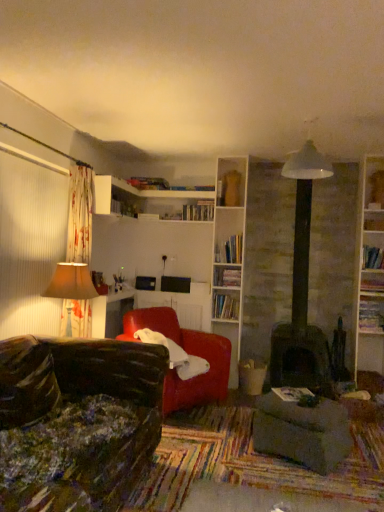
The image size is (384, 512). Describe the element at coordinates (371, 315) in the screenshot. I see `hardcover book at right, which ranks as the fourth book in right-to-left order` at that location.

In order to click on hardcover book at upper right, which is the 5th book from bottom to top in this screenshot , I will do `click(372, 258)`.

What do you see at coordinates (115, 197) in the screenshot? I see `white glossy bookshelf at upper center` at bounding box center [115, 197].

Measure the distance between point (199, 213) and camera.

A distance of 4.84 meters exists between point (199, 213) and camera.

Find the location of `hardcover book at right, placed as the ninth book when sorted from top to bottom`. hardcover book at right, placed as the ninth book when sorted from top to bottom is located at coordinates (371, 315).

Is hardcover book at center, the sixth book from the right, to the right of hardcover book at right, placed as the ninth book when sorted from top to bottom, from the viewer's perspective?

In fact, hardcover book at center, the sixth book from the right, is to the left of hardcover book at right, placed as the ninth book when sorted from top to bottom.

Which object is wider, hardcover book at center, the sixth book from the right, or hardcover book at right, placed as the ninth book when sorted from top to bottom?

hardcover book at center, the sixth book from the right.

Looking at this image, does hardcover book at center, the sixth book from the right, have a larger size compared to hardcover book at right, positioned as the 7th book in left-to-right order?

Correct, hardcover book at center, the sixth book from the right, is larger in size than hardcover book at right, positioned as the 7th book in left-to-right order.

How far apart are hardcover book at center, which is counted as the 5th book, starting from the left, and hardcover book at right, positioned as the 7th book in left-to-right order?

hardcover book at center, which is counted as the 5th book, starting from the left, is 1.47 meters away from hardcover book at right, positioned as the 7th book in left-to-right order.

Which is more to the right, dark gray fabric footrest at lower right or hardcover book at center, which is the 3th book from bottom to top?

dark gray fabric footrest at lower right is more to the right.

Does dark gray fabric footrest at lower right have a larger size compared to hardcover book at center, which is the 3th book from bottom to top?

Correct, dark gray fabric footrest at lower right is larger in size than hardcover book at center, which is the 3th book from bottom to top.

Can you confirm if dark gray fabric footrest at lower right is taller than hardcover book at center, which ranks as the 4th book in left-to-right order?

Yes.

Is hardcover book at center, which is the 3th book from bottom to top, a part of dark gray fabric footrest at lower right?

Definitely not — hardcover book at center, which is the 3th book from bottom to top, is not inside dark gray fabric footrest at lower right.

Between hardcover book at upper right, which is counted as the 2th book, starting from the right, and hardcover book at center, which is counted as the 5th book, starting from the left, which one has larger size?

hardcover book at center, which is counted as the 5th book, starting from the left.

Considering the relative sizes of hardcover book at upper right, which is the 5th book from bottom to top, and hardcover book at center, which is counted as the 5th book, starting from the left, in the image provided, is hardcover book at upper right, which is the 5th book from bottom to top, taller than hardcover book at center, which is counted as the 5th book, starting from the left,?

No, hardcover book at upper right, which is the 5th book from bottom to top, is not taller than hardcover book at center, which is counted as the 5th book, starting from the left.

What's the angular difference between hardcover book at upper right, which is counted as the 2th book, starting from the right, and hardcover book at center, the sixth book from the right,'s facing directions?

The angular difference between hardcover book at upper right, which is counted as the 2th book, starting from the right, and hardcover book at center, the sixth book from the right, is 0.187 degrees.

From the image's perspective, who appears lower, hardcover book at upper right, placed as the 9th book when sorted from left to right, or hardcover book at center, which is the fifth book from top to bottom?

hardcover book at upper right, placed as the 9th book when sorted from left to right, is shown below in the image.

From a real-world perspective, relative to hardcover book at upper right, which is counted as the 6th book, starting from the top, is hardcover book at right, positioned as the 7th book in left-to-right order, vertically above or below?

hardcover book at right, positioned as the 7th book in left-to-right order, is situated lower than hardcover book at upper right, which is counted as the 6th book, starting from the top, in the real world.

Could you tell me if hardcover book at right, which ranks as the fourth book in right-to-left order, is turned towards hardcover book at upper right, placed as the 9th book when sorted from left to right?

No, hardcover book at right, which ranks as the fourth book in right-to-left order, is not facing towards hardcover book at upper right, placed as the 9th book when sorted from left to right.

From the image's perspective, is hardcover book at right, positioned as the 7th book in left-to-right order, located above hardcover book at upper right, which is counted as the 6th book, starting from the top?

No, from the image's perspective, hardcover book at right, positioned as the 7th book in left-to-right order, is not above hardcover book at upper right, which is counted as the 6th book, starting from the top.

Can you confirm if hardcover book at center, which ranks as the 10th book in top-to-bottom order, is shorter than hardcover book at center, which is the 3th book from bottom to top?

Yes, hardcover book at center, which ranks as the 10th book in top-to-bottom order, is shorter than hardcover book at center, which is the 3th book from bottom to top.

Is hardcover book at center, which ranks as the 4th book in left-to-right order, a part of hardcover book at center, the fifth book from the right?

That's incorrect, hardcover book at center, which ranks as the 4th book in left-to-right order, is not inside hardcover book at center, the fifth book from the right.

From a real-world perspective, is hardcover book at center, which ranks as the 6th book in left-to-right order, positioned above or below hardcover book at center, which ranks as the 4th book in left-to-right order?

Clearly, from a real-world perspective, hardcover book at center, which ranks as the 6th book in left-to-right order, is below hardcover book at center, which ranks as the 4th book in left-to-right order.

Based on the photo, can you tell me how much hardcover book at center, the fifth book from the right, and hardcover book at center, the 8th book positioned from the top, differ in facing direction?

There is a 23.7-degree angle between the facing directions of hardcover book at center, the fifth book from the right, and hardcover book at center, the 8th book positioned from the top.

Can you confirm if hardcover book at upper right, marked as the tenth book in a left-to-right arrangement, is positioned to the right of matte red armchair at center?

Yes.

Measure the distance between hardcover book at upper right, marked as the seventh book in a bottom-to-top arrangement, and matte red armchair at center.

They are 2.30 meters apart.

From the image's perspective, between hardcover book at upper right, marked as the seventh book in a bottom-to-top arrangement, and matte red armchair at center, which one is located above?

hardcover book at upper right, marked as the seventh book in a bottom-to-top arrangement, is shown above in the image.

Does hardcover book at upper right, marked as the seventh book in a bottom-to-top arrangement, have a greater height compared to matte red armchair at center?

No.

Is white glossy bookshelf at upper center far from hardcover book at upper right, marked as the tenth book in a left-to-right arrangement?

Yes.

Considering the sizes of white glossy bookshelf at upper center and hardcover book at upper right, positioned as the first book in right-to-left order, in the image, is white glossy bookshelf at upper center taller or shorter than hardcover book at upper right, positioned as the first book in right-to-left order,?

In the image, white glossy bookshelf at upper center appears to be taller than hardcover book at upper right, positioned as the first book in right-to-left order.

Is white glossy bookshelf at upper center situated inside hardcover book at upper right, positioned as the fourth book in top-to-bottom order, or outside?

white glossy bookshelf at upper center is outside hardcover book at upper right, positioned as the fourth book in top-to-bottom order.

What are the coordinates of `the 3rd book below the white glossy bookshelf at upper center (from the image's perspective)` in the screenshot? It's located at (374, 223).

What are the coordinates of `book that is the 2nd object to the left of the hardcover book at right, placed as the ninth book when sorted from top to bottom, starting at the anchor` in the screenshot? It's located at (230, 250).

Locate an element on the screen. The width and height of the screenshot is (384, 512). book that is the 3rd object located above the dark gray fabric footrest at lower right (from the image's perspective) is located at coordinates (225, 306).

When comparing their distances from hardcover book at center, which ranks as the 10th book in top-to-bottom order, does dark gray fabric footrest at lower right or hardcover book at upper right, which is counted as the 2th book, starting from the right, seem closer?

dark gray fabric footrest at lower right lies closer to hardcover book at center, which ranks as the 10th book in top-to-bottom order, than the other object.

Which object lies nearer to the anchor point hardcover book at right, the second book from the bottom, dark gray fabric footrest at lower right or hardcover book at right, arranged as the 8th book when viewed from the left?

hardcover book at right, arranged as the 8th book when viewed from the left.

When comparing their distances from hardcover book at right, positioned as the 7th book in left-to-right order, does matte red armchair at center or white glossy bookshelf at upper center seem further?

Based on the image, white glossy bookshelf at upper center appears to be further to hardcover book at right, positioned as the 7th book in left-to-right order.

Considering their positions, is hardcover book at center, the fifth book from the right, positioned further to hardcover book at upper center, placed as the 2th book when sorted from top to bottom, than hardcover book at right, arranged as the 8th book when viewed from the left?

hardcover book at center, the fifth book from the right, is further to hardcover book at upper center, placed as the 2th book when sorted from top to bottom.

Looking at the image, which one is located closer to beige fabric lampshade at left, hardcover book at right, positioned as the 7th book in left-to-right order, or hardcover book at upper center, the ninth book when ordered from right to left?

hardcover book at upper center, the ninth book when ordered from right to left, is positioned closer to the anchor beige fabric lampshade at left.

Estimate the real-world distances between objects in this image. Which object is closer to hardcover book at upper right, marked as the seventh book in a bottom-to-top arrangement, beige fabric lampshade at left or hardcover book at upper right, which is counted as the 2th book, starting from the right?

hardcover book at upper right, which is counted as the 2th book, starting from the right, is closer to hardcover book at upper right, marked as the seventh book in a bottom-to-top arrangement.

Estimate the real-world distances between objects in this image. Which object is further from dark gray fabric footrest at lower right, hardcover book at upper center, which is the ninth book in bottom-to-top order, or hardcover book at upper right, marked as the seventh book in a bottom-to-top arrangement?

hardcover book at upper center, which is the ninth book in bottom-to-top order, is positioned further to the anchor dark gray fabric footrest at lower right.

Looking at the image, which one is located closer to hardcover book at upper right, marked as the seventh book in a bottom-to-top arrangement, hardcover books at center, the 3th book positioned from the left, or beige fabric lampshade at left?

hardcover books at center, the 3th book positioned from the left.

This screenshot has width=384, height=512. I want to click on chair positioned between beige fabric lampshade at left and hardcover books at center, the 8th book positioned from the bottom, from near to far, so click(x=188, y=353).

You are a GUI agent. You are given a task and a screenshot of the screen. Output one action in this format:
    pyautogui.click(x=<x>, y=<y>)
    Task: Click on the shelf that lies between hardcover book at upper center, which is the 1th book in top-to-bottom order, and hardcover book at center, which ranks as the 6th book in left-to-right order, from top to bottom
    
    Given the screenshot: What is the action you would take?
    pyautogui.click(x=115, y=197)

I want to click on table lamp that lies between white glossy bookshelf at upper center and matte red armchair at center from top to bottom, so click(x=71, y=286).

This screenshot has height=512, width=384. I want to click on the footrest located between hardcover book at upper center, positioned as the tenth book in right-to-left order, and hardcover book at upper right, marked as the seventh book in a bottom-to-top arrangement, in the left-right direction, so click(x=302, y=432).